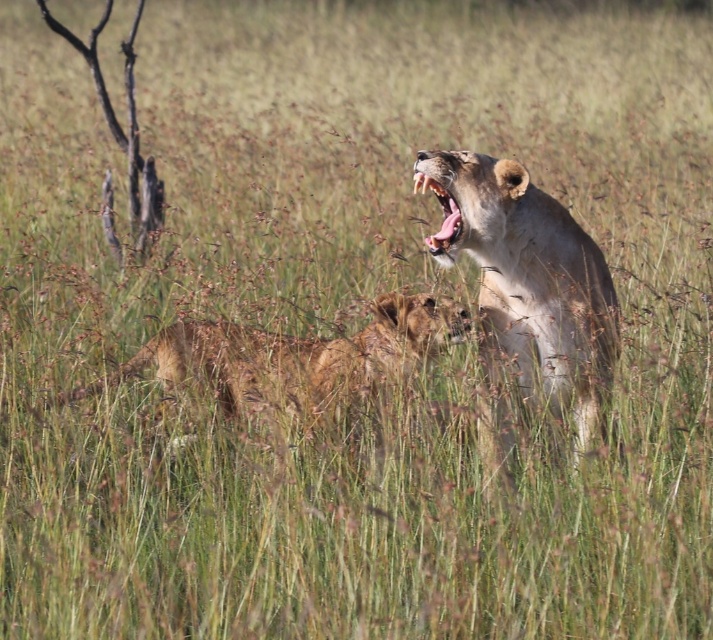
Question: Is light brown fur lion at upper right positioned in front of smooth tan lion mouth at upper right?

Choices:
 (A) yes
 (B) no

Answer: (A)

Question: Which object appears closest to the camera in this image?

Choices:
 (A) light brown fur lion at upper right
 (B) golden fur lion at center

Answer: (A)

Question: Which point is closer to the camera?

Choices:
 (A) tap(277, 372)
 (B) tap(436, 241)
 (C) tap(458, 237)

Answer: (B)

Question: Which point is farther to the camera?

Choices:
 (A) pos(525,317)
 (B) pos(410,324)
 (C) pos(451,225)

Answer: (B)

Question: Does light brown fur lion at upper right appear over golden fur lion at center?

Choices:
 (A) no
 (B) yes

Answer: (B)

Question: Does light brown fur lion at upper right appear on the left side of smooth tan lion mouth at upper right?

Choices:
 (A) no
 (B) yes

Answer: (A)